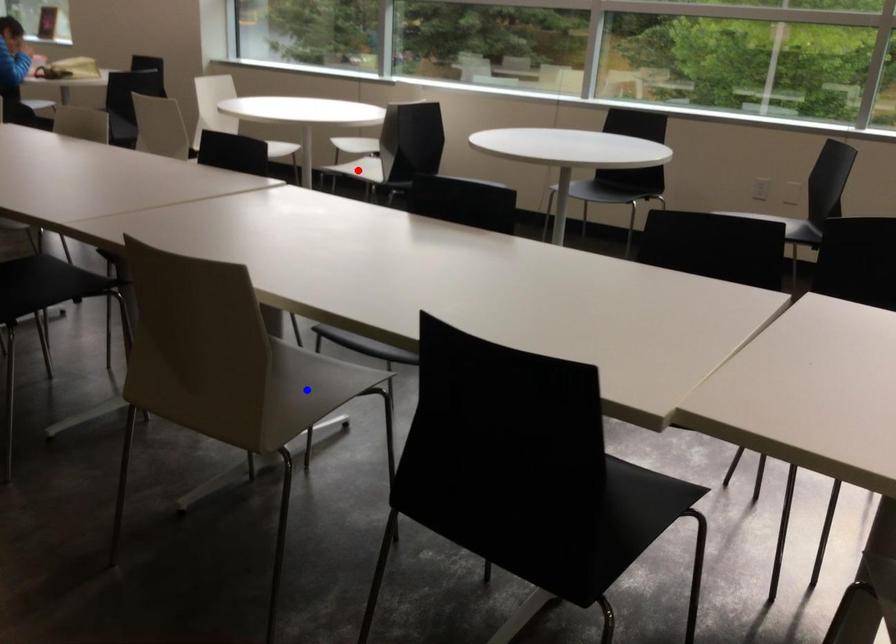
Question: Two points are marked on the image. Which point is closer to the camera?

Choices:
 (A) Blue point is closer.
 (B) Red point is closer.

Answer: (A)